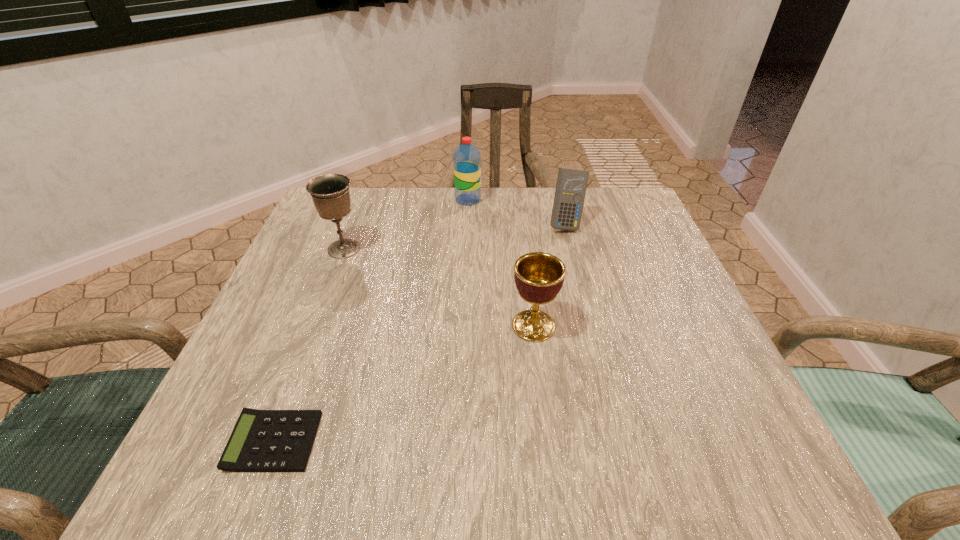
The image size is (960, 540). Find the location of `the third object from left to right`. the third object from left to right is located at coordinates (466, 159).

Locate an element on the screen. The width and height of the screenshot is (960, 540). water bottle is located at coordinates (466, 159).

The image size is (960, 540). I want to click on the left chalice, so click(330, 193).

Image resolution: width=960 pixels, height=540 pixels. I want to click on the third farthest object, so click(330, 193).

Where is `the second farthest object`? The width and height of the screenshot is (960, 540). the second farthest object is located at coordinates (571, 186).

You are a GUI agent. You are given a task and a screenshot of the screen. Output one action in this format:
    pyautogui.click(x=<x>, y=<y>)
    Task: Click on the taller calculator
    This screenshot has width=960, height=540.
    Given the screenshot: What is the action you would take?
    pyautogui.click(x=571, y=186)

Locate an element on the screen. The height and width of the screenshot is (540, 960). the nearer chalice is located at coordinates (539, 277).

Where is `the second nearest object`? Image resolution: width=960 pixels, height=540 pixels. the second nearest object is located at coordinates (539, 277).

Image resolution: width=960 pixels, height=540 pixels. What are the coordinates of `the nearest object` in the screenshot? It's located at (262, 440).

Identify the location of the shorter calculator. (262, 440).